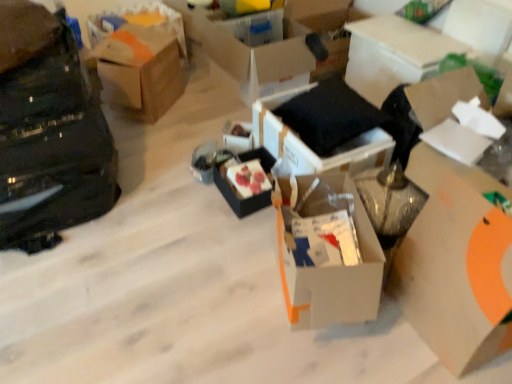
The image size is (512, 384). In order to click on vacant area that is in front of white cardboard box at center, which ranks as the fourth box in left-to-right order in this screenshot , I will do `click(323, 360)`.